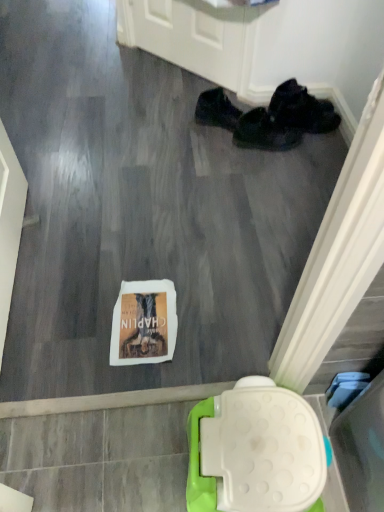
Identify the location of vacant area that is in front of black fabric shoe at upper right, the third footwear viewed from the right. (206, 144).